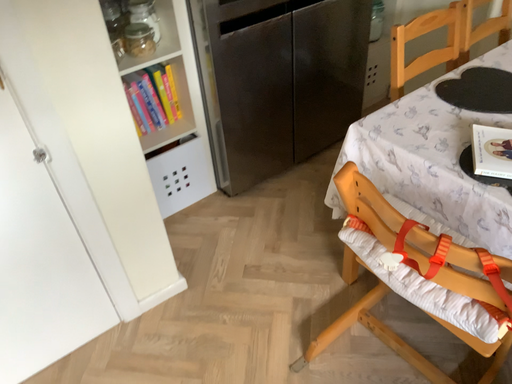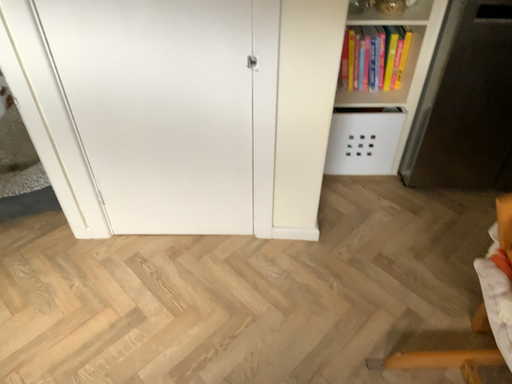
Question: How did the camera likely rotate when shooting the video?

Choices:
 (A) rotated left
 (B) rotated right

Answer: (A)